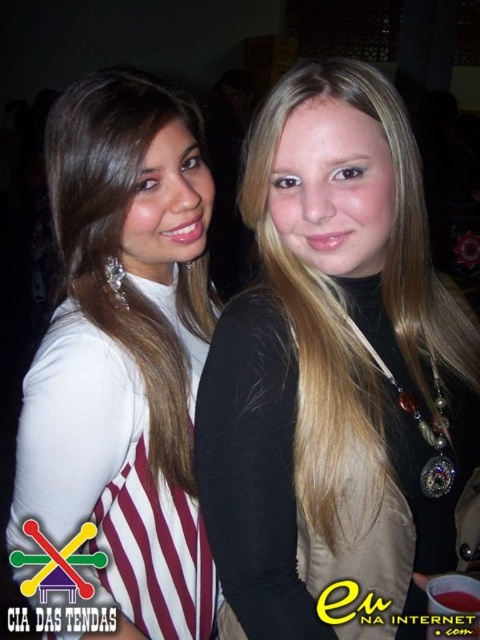
Between black matte vest at center and white matte dress at center, which one has less height?

black matte vest at center

Is black matte vest at center taller than white matte dress at center?

No, black matte vest at center is not taller than white matte dress at center.

At what (x,y) coordinates should I click in order to perform the action: click on black matte vest at center. Please return your answer as a coordinate pair (x, y). Looking at the image, I should click on (335, 372).